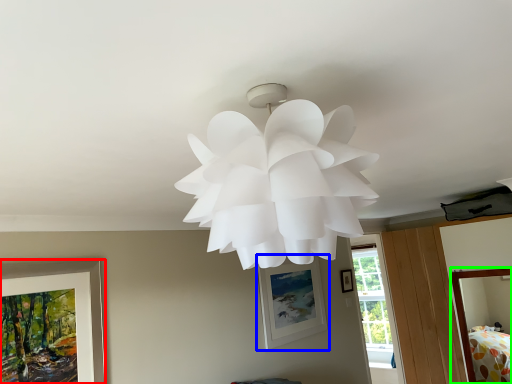
Question: Which object is the closest to the picture frame (highlighted by a red box)? Choose among these: picture frame (highlighted by a blue box) or bed (highlighted by a green box).

Choices:
 (A) picture frame
 (B) bed

Answer: (A)